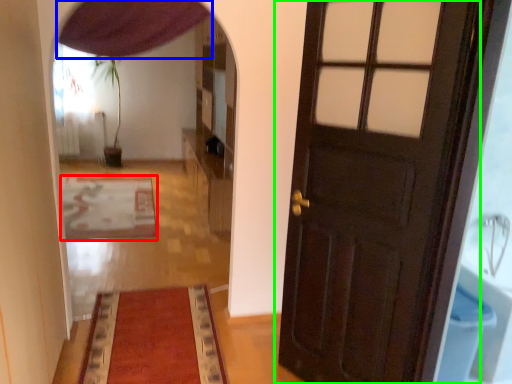
Question: Which is nearer to the mat (highlighted by a red box)? curtain (highlighted by a blue box) or door (highlighted by a green box).

Choices:
 (A) curtain
 (B) door

Answer: (A)